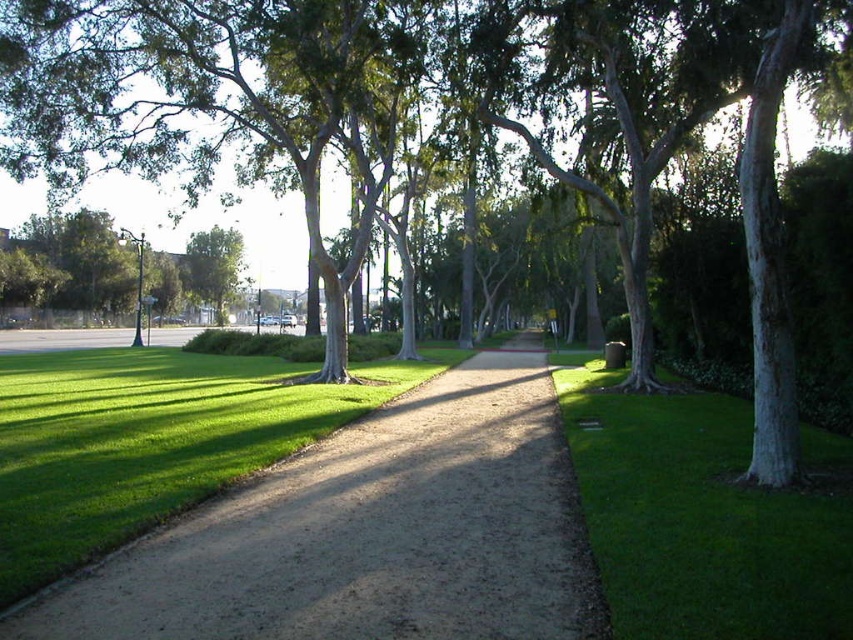
Question: Which point is farther to the camera?

Choices:
 (A) dirt path at center
 (B) green leafy tree at left
 (C) green grass at lower right

Answer: (B)

Question: Is dirt path at center in front of green leafy tree at left?

Choices:
 (A) no
 (B) yes

Answer: (B)

Question: Which of these objects is positioned farthest from the green leafy tree at left?

Choices:
 (A) green leafy tree at center
 (B) dirt path at center

Answer: (B)

Question: Is green grass at lower right positioned behind green leafy tree at left?

Choices:
 (A) no
 (B) yes

Answer: (A)

Question: Which object is positioned farthest from the green grass at lower right?

Choices:
 (A) green leafy tree at center
 (B) green leafy tree at left
 (C) dirt path at center

Answer: (A)

Question: Does dirt path at center appear under green leafy tree at center?

Choices:
 (A) yes
 (B) no

Answer: (A)